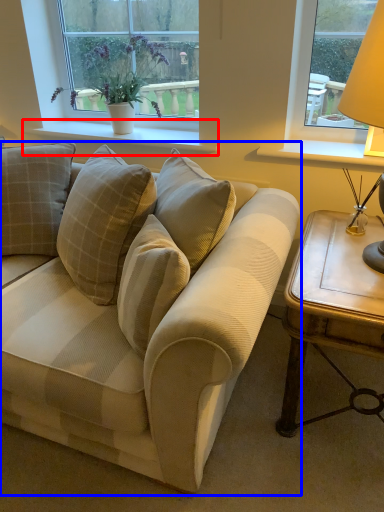
Question: Among these objects, which one is farthest to the camera, window sill (highlighted by a red box) or studio couch (highlighted by a blue box)?

Choices:
 (A) window sill
 (B) studio couch

Answer: (A)